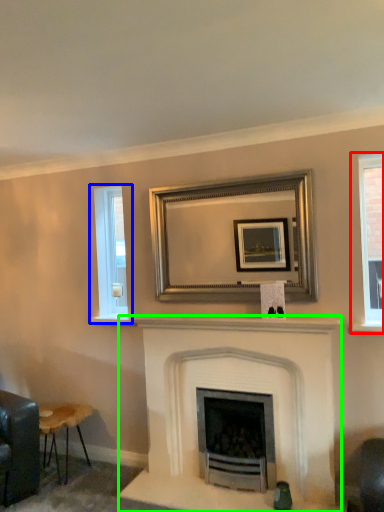
Question: Which object is the closest to the window (highlighted by a red box)? Choose among these: window (highlighted by a blue box) or fireplace (highlighted by a green box).

Choices:
 (A) window
 (B) fireplace

Answer: (B)